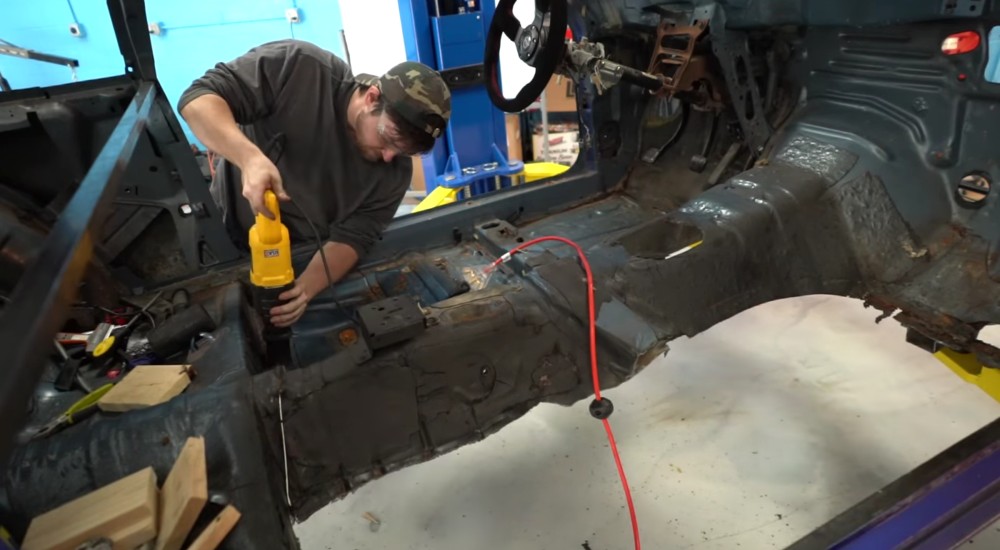
Locate an element on the screen. frame is located at coordinates (910, 519).